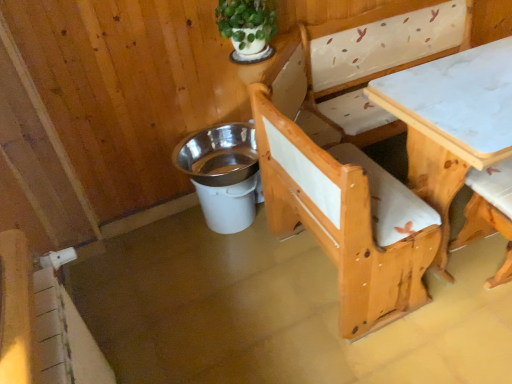
Where is `vacant area situated to the left side of wooden chair at lower right`? vacant area situated to the left side of wooden chair at lower right is located at coordinates (445, 294).